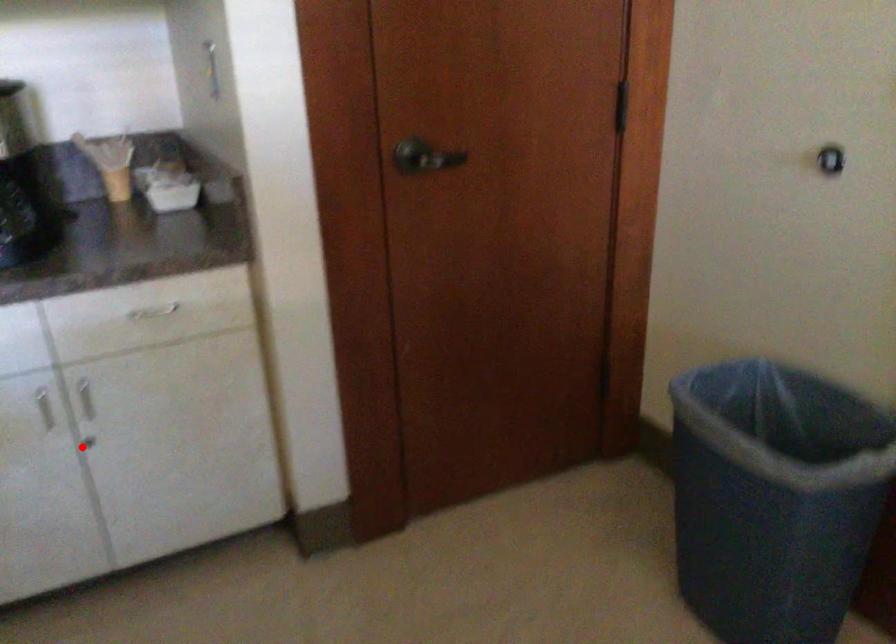
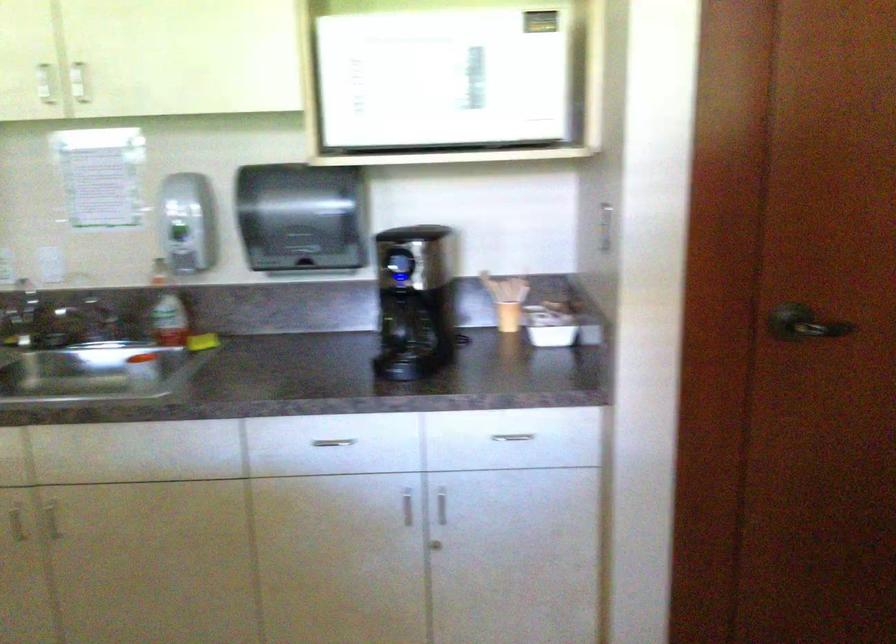
Where in the second image is the point corresponding to the highlighted location from the first image?

(435, 545)